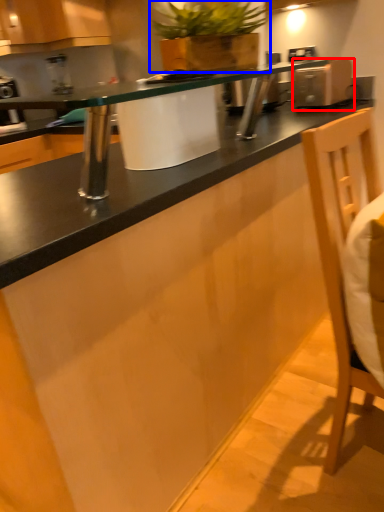
Question: Among these objects, which one is farthest to the camera, appliance (highlighted by a red box) or houseplant (highlighted by a blue box)?

Choices:
 (A) appliance
 (B) houseplant

Answer: (A)